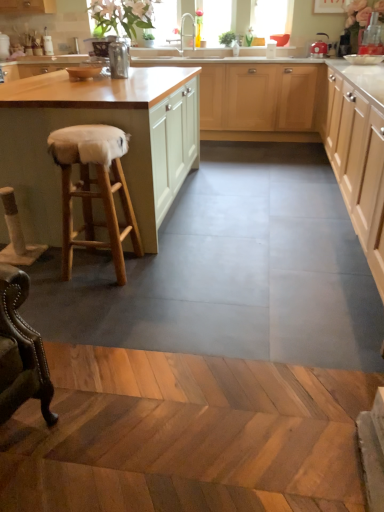
Question: Can you confirm if matte white cabinets at center, which is the second cabinetry in left-to-right order, is smaller than transparent glass window screen at upper center?

Choices:
 (A) yes
 (B) no

Answer: (B)

Question: Is the position of matte white cabinets at center, which is the second cabinetry in left-to-right order, less distant than that of transparent glass window screen at upper center?

Choices:
 (A) yes
 (B) no

Answer: (A)

Question: Is matte white cabinets at center, which is the 2th cabinetry in right-to-left order, to the left of transparent glass window screen at upper center from the viewer's perspective?

Choices:
 (A) yes
 (B) no

Answer: (A)

Question: Does matte white cabinets at center, which is the 2th cabinetry in right-to-left order, appear on the right side of transparent glass window screen at upper center?

Choices:
 (A) yes
 (B) no

Answer: (B)

Question: From the image's perspective, is matte white cabinets at center, which is the second cabinetry in left-to-right order, under transparent glass window screen at upper center?

Choices:
 (A) yes
 (B) no

Answer: (A)

Question: Looking at the image, does matte red kettle at upper right seem bigger or smaller compared to wooden stool at left, the 3th cabinetry from the right?

Choices:
 (A) small
 (B) big

Answer: (A)

Question: In terms of width, does matte red kettle at upper right look wider or thinner when compared to wooden stool at left, marked as the first cabinetry in a left-to-right arrangement?

Choices:
 (A) thin
 (B) wide

Answer: (A)

Question: Choose the correct answer: Is matte red kettle at upper right inside wooden stool at left, the 3th cabinetry from the right, or outside it?

Choices:
 (A) inside
 (B) outside

Answer: (B)

Question: From the image's perspective, is matte red kettle at upper right located above or below wooden stool at left, the 3th cabinetry from the right?

Choices:
 (A) below
 (B) above

Answer: (B)

Question: From the image's perspective, relative to transparent glass window screen at upper center, is matte red kettle at upper right above or below?

Choices:
 (A) below
 (B) above

Answer: (A)

Question: Which is correct: matte red kettle at upper right is inside transparent glass window screen at upper center, or outside of it?

Choices:
 (A) outside
 (B) inside

Answer: (A)

Question: Relative to transparent glass window screen at upper center, is matte red kettle at upper right in front or behind?

Choices:
 (A) behind
 (B) front

Answer: (B)

Question: Is matte red kettle at upper right bigger or smaller than transparent glass window screen at upper center?

Choices:
 (A) big
 (B) small

Answer: (B)

Question: In terms of size, does matte red kettle at upper right appear bigger or smaller than matte white cabinets at center, which is the 2th cabinetry in right-to-left order?

Choices:
 (A) big
 (B) small

Answer: (B)

Question: From a real-world perspective, is matte red kettle at upper right physically located above or below matte white cabinets at center, which is the 2th cabinetry in right-to-left order?

Choices:
 (A) above
 (B) below

Answer: (A)